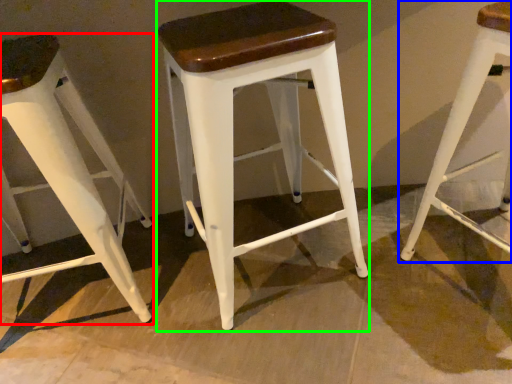
Question: Considering the real-world distances, which object is closest to stool (highlighted by a red box)? stool (highlighted by a blue box) or stool (highlighted by a green box).

Choices:
 (A) stool
 (B) stool

Answer: (B)